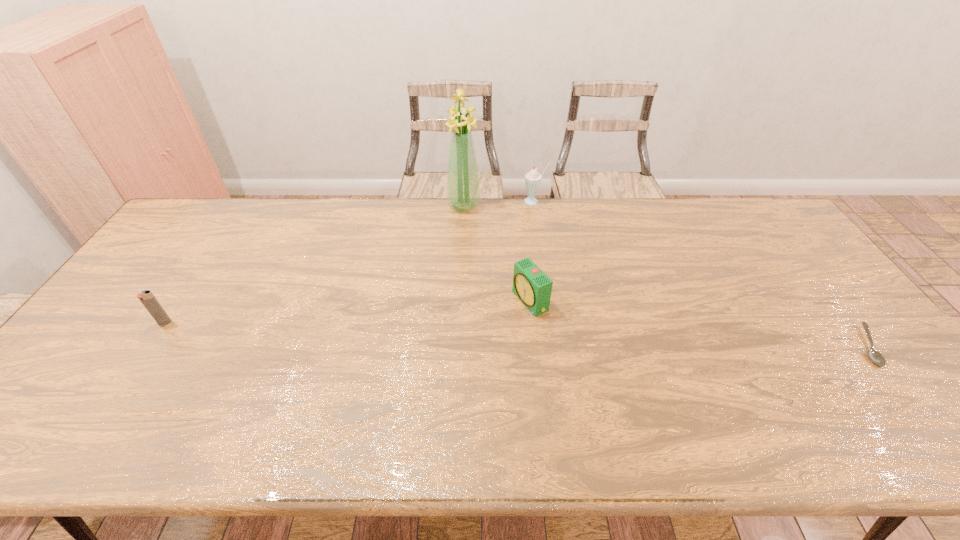
At what (x,y) coordinates should I click in order to perform the action: click on object present at the left edge. Please return your answer as a coordinate pair (x, y). This screenshot has height=540, width=960. Looking at the image, I should click on (147, 298).

Image resolution: width=960 pixels, height=540 pixels. I want to click on object at the right edge, so click(875, 356).

You are a GUI agent. You are given a task and a screenshot of the screen. Output one action in this format:
    pyautogui.click(x=<x>, y=<y>)
    Task: Click on the vacant space at the far edge
    Image resolution: width=960 pixels, height=540 pixels.
    Given the screenshot: What is the action you would take?
    pyautogui.click(x=569, y=225)

Where is `free location at the near edge of the desktop`? The width and height of the screenshot is (960, 540). free location at the near edge of the desktop is located at coordinates (453, 386).

The image size is (960, 540). What are the coordinates of `free space at the left edge of the desktop` in the screenshot? It's located at (84, 362).

Where is `vacant space at the right edge of the desktop`? The image size is (960, 540). vacant space at the right edge of the desktop is located at coordinates (824, 329).

At what (x,y) coordinates should I click in order to perform the action: click on free space at the far left corner of the desktop. Please return your answer as a coordinate pair (x, y). Looking at the image, I should click on (189, 224).

At what (x,y) coordinates should I click in order to perform the action: click on vacant area at the far right corner of the desktop. Please return your answer as a coordinate pair (x, y). Looking at the image, I should click on (738, 213).

This screenshot has height=540, width=960. In order to click on blank region between the milkshake and the igniter in this screenshot , I will do `click(349, 262)`.

Where is `vacant space in between the leftmost object and the rightmost object`? This screenshot has height=540, width=960. vacant space in between the leftmost object and the rightmost object is located at coordinates (516, 334).